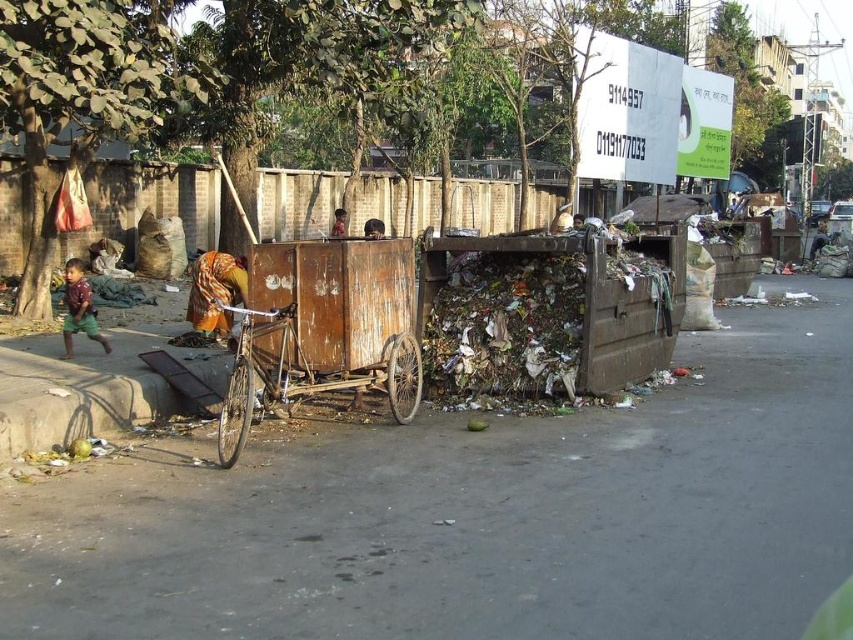
Question: Which of the following is the farthest from the observer?

Choices:
 (A) matte brown shirt at left
 (B) brown fabric at center
 (C) rusty metal cart at center

Answer: (B)

Question: Which is nearer to the rusty metal bicycle at center?

Choices:
 (A) brown fabric at center
 (B) yellow-orange fabric at center
 (C) matte brown shirt at left
 (D) rusty wood cart at center

Answer: (D)

Question: Does rusty metal bicycle at center appear over brown fabric at center?

Choices:
 (A) yes
 (B) no

Answer: (B)

Question: Which object appears closest to the camera in this image?

Choices:
 (A) rusty metal cart at center
 (B) brown fabric at center
 (C) matte brown shirt at left
 (D) yellow-orange fabric at center

Answer: (A)

Question: Can you confirm if rusty wood cart at center is positioned to the right of brown fabric at center?

Choices:
 (A) no
 (B) yes

Answer: (B)

Question: Does rusty wood cart at center come in front of yellow-orange fabric at center?

Choices:
 (A) yes
 (B) no

Answer: (A)